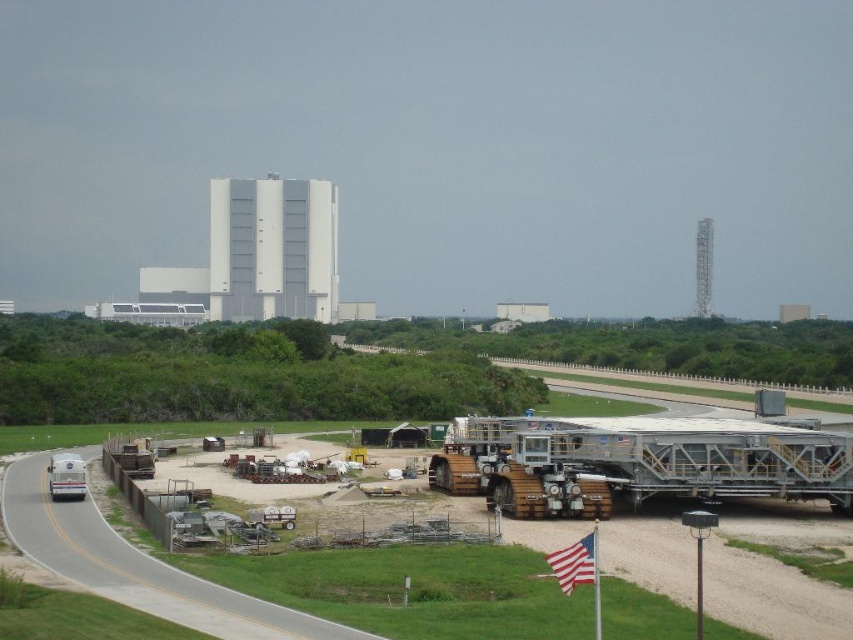
Question: Is metallic gray trailer truck at center right behind gray asphalt highway at lower left?

Choices:
 (A) no
 (B) yes

Answer: (B)

Question: Is gray asphalt highway at lower left smaller than american flag at lower right?

Choices:
 (A) no
 (B) yes

Answer: (A)

Question: Which point is closer to the camera?

Choices:
 (A) metallic gray construction equipment at lower center
 (B) metallic gray trailer truck at center right

Answer: (A)

Question: Which object is farther from the camera taking this photo?

Choices:
 (A) gray asphalt highway at lower left
 (B) american flag at lower right
 (C) metallic gray construction equipment at lower center

Answer: (C)

Question: Can you confirm if metallic gray trailer truck at center right is thinner than american flag at lower right?

Choices:
 (A) no
 (B) yes

Answer: (A)

Question: Which point appears farthest from the camera in this image?

Choices:
 (A) (589, 563)
 (B) (372, 634)
 (C) (584, 502)
 (D) (109, 547)

Answer: (C)